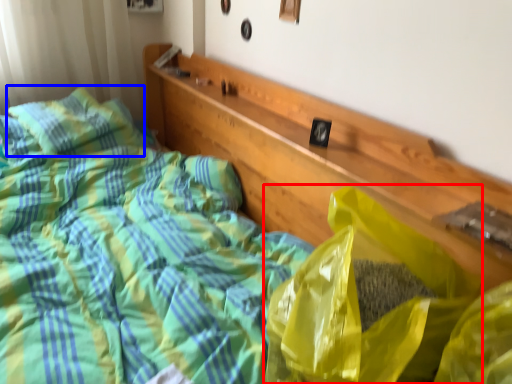
Question: Among these objects, which one is nearest to the camera, plastic bag (highlighted by a red box) or pillow (highlighted by a blue box)?

Choices:
 (A) plastic bag
 (B) pillow

Answer: (A)